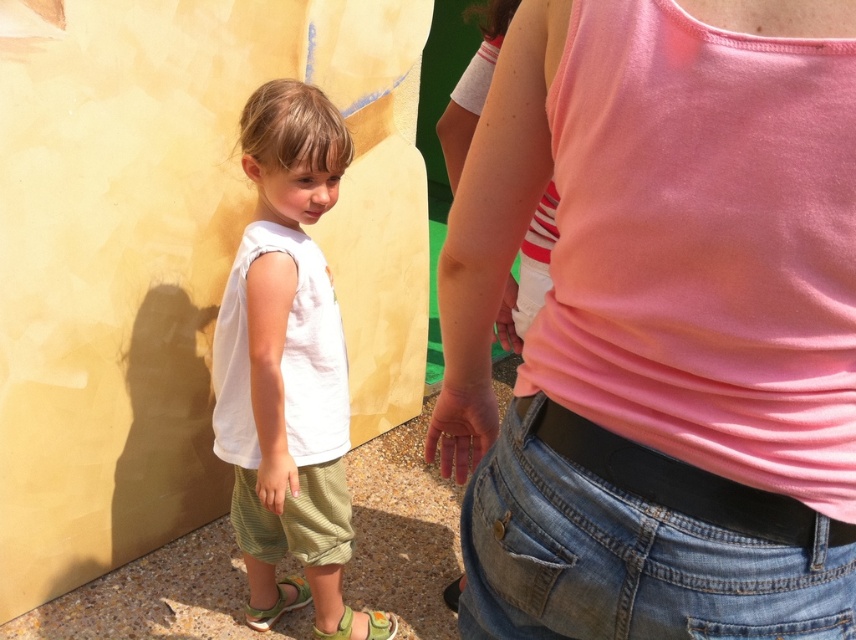
You are standing in the scene and want to locate the white cotton shirt at center. Where would you look relative to the child?

The white cotton shirt at center is located at point 0.553 on the x axis and 0.335 on the y axis.

You are a photographer trying to capture the child and the adult in a single shot. The adult is partially visible at point (660, 324). The child is on the left. Where should you position the pink fabric tank top at upper center to ensure both subjects are fully visible in the frame?

The pink fabric tank top at upper center should be positioned so that it does not block the adult at point (660, 324) and the child on the left. Adjust the tank top to the side or lower it to maintain visibility of both subjects.

You are a photographer trying to capture the white cotton shirt at center and the light green fabric sandal at lower left in the same frame. Based on their positions, which object should you focus on first to ensure both are in the frame?

The white cotton shirt at center is located above the light green fabric sandal at lower left, so you should focus on the white cotton shirt at center first to ensure both are in the frame.